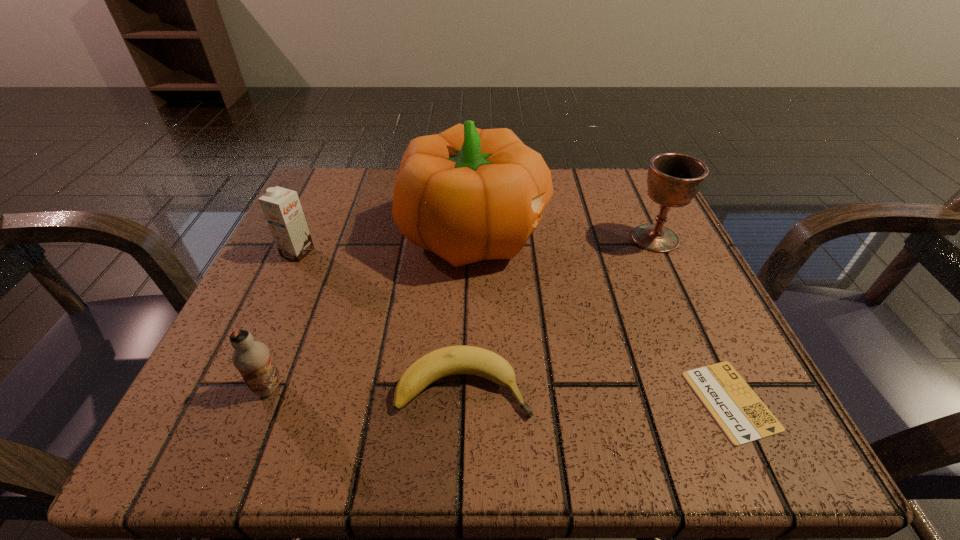
Locate an element on the screen. free space that satisfies the following two spatial constraints: 1. on the carved face of the pumpkin; 2. on the right side of the chalice is located at coordinates (475, 239).

The height and width of the screenshot is (540, 960). Find the location of `free location that satisfies the following two spatial constraints: 1. on the front side of the chalice; 2. at the stem of the banana`. free location that satisfies the following two spatial constraints: 1. on the front side of the chalice; 2. at the stem of the banana is located at coordinates (725, 388).

The height and width of the screenshot is (540, 960). Identify the location of free point that satisfies the following two spatial constraints: 1. at the stem of the banana; 2. on the right side of the shortest object. (463, 401).

Find the location of a particular element. The width and height of the screenshot is (960, 540). vacant area that satisfies the following two spatial constraints: 1. at the stem of the shortest object; 2. on the left side of the banana is located at coordinates (463, 401).

At what (x,y) coordinates should I click in order to perform the action: click on free location that satisfies the following two spatial constraints: 1. on the carved face of the shortest object; 2. on the right side of the tallest object. Please return your answer as a coordinate pair (x, y). The width and height of the screenshot is (960, 540). Looking at the image, I should click on (472, 401).

This screenshot has height=540, width=960. Identify the location of vacant point that satisfies the following two spatial constraints: 1. on the carved face of the pumpkin; 2. on the right side of the chalice. (475, 239).

Identify the location of free space that satisfies the following two spatial constraints: 1. at the stem of the fifth tallest object; 2. on the back side of the identity card. (463, 401).